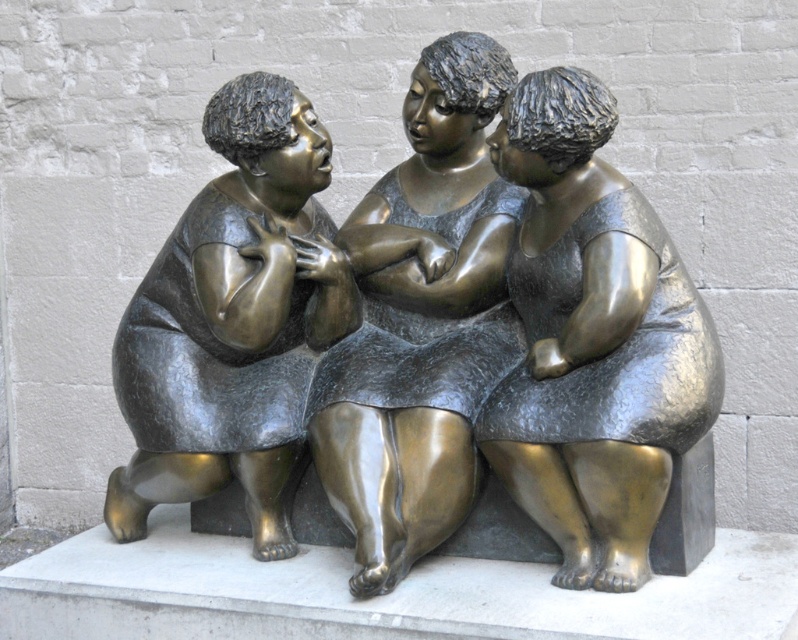
You are an art student analyzing the composition of the sculpture. You notice the bronze sculpture at center and the bronze textured dress at center. Which object is positioned lower in the image?

The bronze sculpture at center is located below the bronze textured dress at center, so the bronze sculpture at center is positioned lower.

You are an art student analyzing the sculpture. You notice the bronze textured dress at center. Where exactly is it positioned relative to the brick wall backdrop?

The bronze textured dress at center is positioned at coordinates point (421, 321) relative to the brick wall backdrop.

In the scene shown: You are an art conservator examining the bronze sculpture. You notice two points of corrosion on the sculpture. The first corrosion point is at coordinate point (352, 349) and the second is at point (295, 132). Which corrosion point is closer to the viewer?

Point (295, 132) is closer to the viewer because according to the description, point (352, 349) is behind point (295, 132).